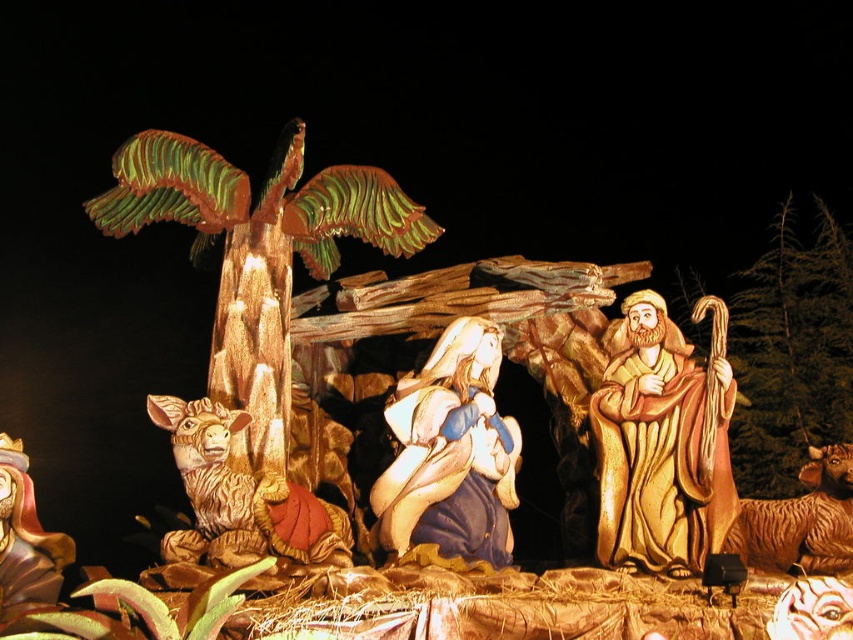
From the picture: In the nativity scene, you see the matte blue fabric at center and the golden textured donkey at lower left. Which object is positioned to the right of the other?

The matte blue fabric at center is positioned to the right of the golden textured donkey at lower left.

Looking at the nativity scene, you notice the golden carved shepherd at right and the matte blue fabric at center. Which object takes up more space in the image?

The golden carved shepherd at right is larger in size than the matte blue fabric at center, so it takes up more space in the image.